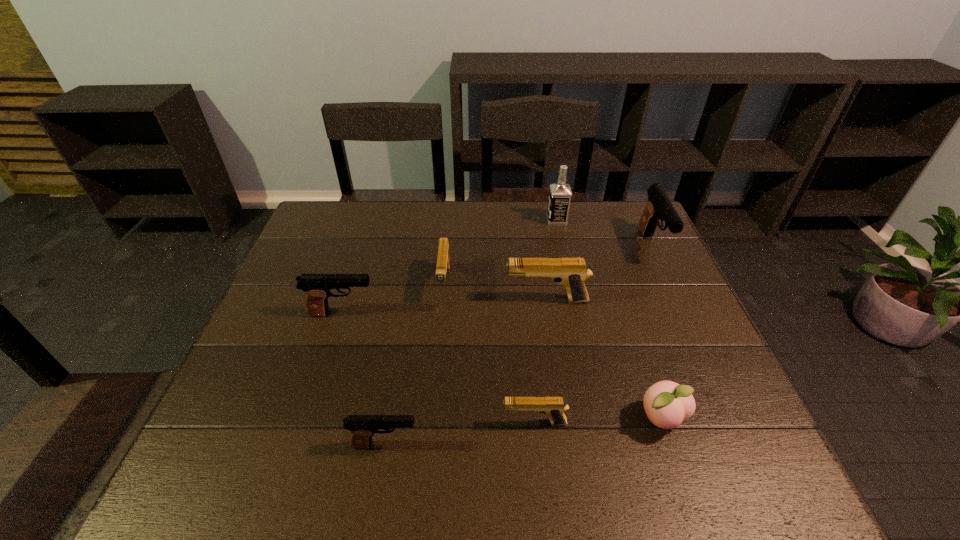
Where is `vacant space that satisfies the following two spatial constraints: 1. at the barrel of the peach; 2. on the right side of the fourth pistol from right to left`? vacant space that satisfies the following two spatial constraints: 1. at the barrel of the peach; 2. on the right side of the fourth pistol from right to left is located at coordinates (432, 420).

Identify the location of free spot that satisfies the following two spatial constraints: 1. on the back side of the pink peach; 2. at the barrel of the biggest tan pistol. The width and height of the screenshot is (960, 540). (622, 300).

The height and width of the screenshot is (540, 960). Identify the location of free spot that satisfies the following two spatial constraints: 1. at the barrel of the leftmost black pistol; 2. on the back side of the peach. (309, 420).

At what (x,y) coordinates should I click in order to perform the action: click on blank area in the image that satisfies the following two spatial constraints: 1. at the barrel of the fifth farthest object; 2. on the back side of the second object from right to left. Please return your answer as a coordinate pair (x, y). The image size is (960, 540). Looking at the image, I should click on (309, 420).

Identify the location of free space in the image that satisfies the following two spatial constraints: 1. at the barrel of the leftmost object; 2. on the left side of the peach. This screenshot has width=960, height=540. (309, 420).